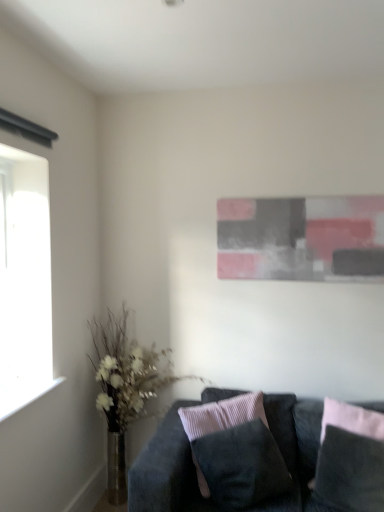
Question: Is abstract painting at upper center behind suede-like black pillow at center, the 2th pillow from the right?

Choices:
 (A) no
 (B) yes

Answer: (B)

Question: From a real-world perspective, is abstract painting at upper center physically below suede-like black pillow at center, the 2th pillow from the right?

Choices:
 (A) yes
 (B) no

Answer: (B)

Question: Does abstract painting at upper center have a greater width compared to suede-like black pillow at center, which is the 1th pillow from left to right?

Choices:
 (A) yes
 (B) no

Answer: (B)

Question: Is suede-like black pillow at center, the 2th pillow from the right, inside abstract painting at upper center?

Choices:
 (A) yes
 (B) no

Answer: (B)

Question: Considering the relative sizes of abstract painting at upper center and suede-like black pillow at center, which is the 1th pillow from left to right, in the image provided, is abstract painting at upper center shorter than suede-like black pillow at center, which is the 1th pillow from left to right,?

Choices:
 (A) no
 (B) yes

Answer: (A)

Question: Considering the positions of velvet dark gray pillow at lower right, which appears as the 1th pillow when viewed from the right, and suede-like black pillow at center, which is the 1th pillow from left to right, in the image, is velvet dark gray pillow at lower right, which appears as the 1th pillow when viewed from the right, bigger or smaller than suede-like black pillow at center, which is the 1th pillow from left to right,?

Choices:
 (A) small
 (B) big

Answer: (A)

Question: From a real-world perspective, relative to suede-like black pillow at center, which is the 1th pillow from left to right, is velvet dark gray pillow at lower right, which ranks as the 2th pillow in left-to-right order, vertically above or below?

Choices:
 (A) below
 (B) above

Answer: (B)

Question: In terms of width, does velvet dark gray pillow at lower right, which appears as the 1th pillow when viewed from the right, look wider or thinner when compared to suede-like black pillow at center, which is the 1th pillow from left to right?

Choices:
 (A) thin
 (B) wide

Answer: (A)

Question: Is point (367, 508) closer or farther from the camera than point (200, 468)?

Choices:
 (A) farther
 (B) closer

Answer: (B)

Question: In the image, is suede black couch at lower right on the left side or the right side of velvet dark gray pillow at lower right, which ranks as the 2th pillow in left-to-right order?

Choices:
 (A) right
 (B) left

Answer: (B)

Question: From the image's perspective, is suede black couch at lower right above or below velvet dark gray pillow at lower right, which ranks as the 2th pillow in left-to-right order?

Choices:
 (A) below
 (B) above

Answer: (A)

Question: Does point (316, 443) appear closer or farther from the camera than point (367, 479)?

Choices:
 (A) closer
 (B) farther

Answer: (B)

Question: Is suede black couch at lower right inside the boundaries of velvet dark gray pillow at lower right, which ranks as the 2th pillow in left-to-right order, or outside?

Choices:
 (A) inside
 (B) outside

Answer: (B)

Question: Does point (352, 230) appear closer or farther from the camera than point (251, 414)?

Choices:
 (A) closer
 (B) farther

Answer: (B)

Question: Considering the positions of abstract painting at upper center and suede-like black pillow at center, the 2th pillow from the right, in the image, is abstract painting at upper center wider or thinner than suede-like black pillow at center, the 2th pillow from the right,?

Choices:
 (A) wide
 (B) thin

Answer: (B)